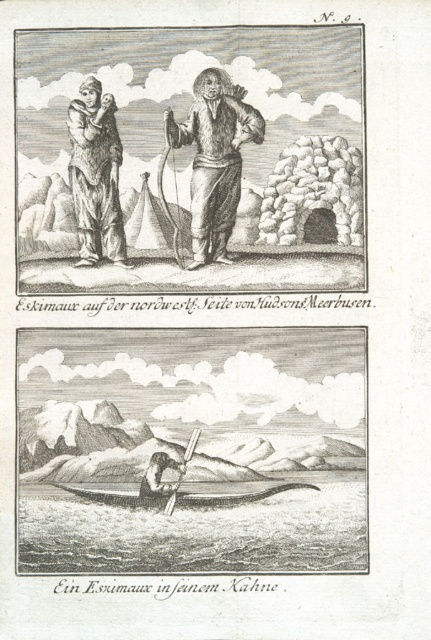
Based on the historical engraving, where is the brown fur coat at left positioned relative to the other elements in the top section?

The brown fur coat at left is located at point 0.223 on the y axis and 0.273 on the x axis.

You are an anthropologist examining this historical engraving and notice two figures in the top section. One is wearing a brown fur coat at left, and the other is a smooth skin person at lower center. Based on their positions, which figure is located to the east if the engraving is oriented with north at the top?

The brown fur coat at left is positioned on the left side of the smooth skin person at lower center. Since the engraving is oriented with north at the top, left would correspond to west. Therefore, the smooth skin person at lower center is to the east of the brown fur coat at left.